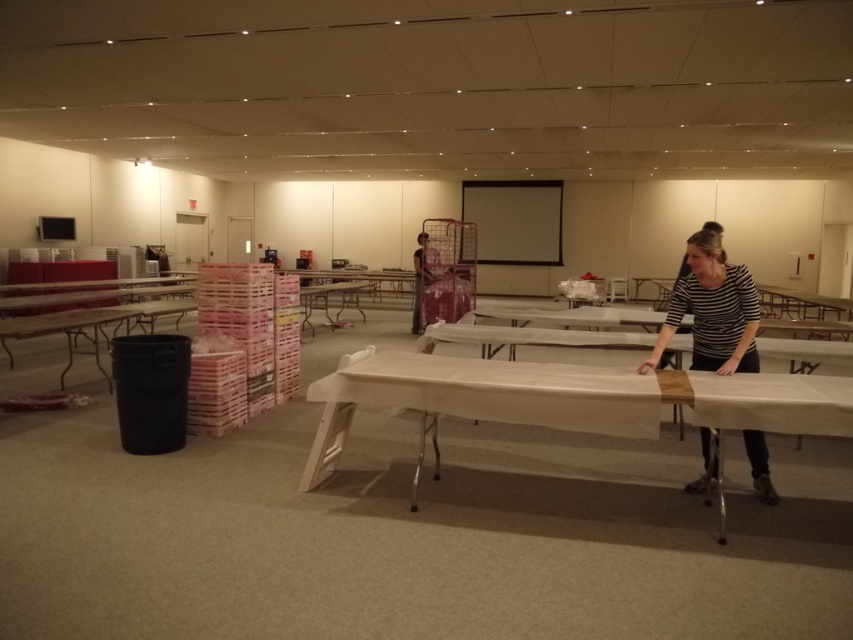
Is white fabric-covered table at center smaller than matte white projection screen at upper center?

No, white fabric-covered table at center is not smaller than matte white projection screen at upper center.

Is white fabric-covered table at center wider than matte white projection screen at upper center?

Yes, white fabric-covered table at center is wider than matte white projection screen at upper center.

Locate an element on the screen. The image size is (853, 640). white fabric-covered table at center is located at coordinates (575, 400).

This screenshot has width=853, height=640. Describe the element at coordinates (514, 220) in the screenshot. I see `matte black projection screen at center` at that location.

Does matte black projection screen at center have a greater width compared to patterned fabric dress at center?

Yes.

Is point (560, 195) positioned before point (418, 241)?

No, it is behind (418, 241).

Locate an element on the screen. The image size is (853, 640). matte black projection screen at center is located at coordinates (514, 220).

Who is shorter, striped cotton shirt at right or matte black projection screen at center?

striped cotton shirt at right

Image resolution: width=853 pixels, height=640 pixels. Describe the element at coordinates (712, 308) in the screenshot. I see `striped cotton shirt at right` at that location.

Who is more distant from viewer, (728,301) or (514,227)?

The point (514,227) is more distant.

Image resolution: width=853 pixels, height=640 pixels. I want to click on striped cotton shirt at right, so click(x=712, y=308).